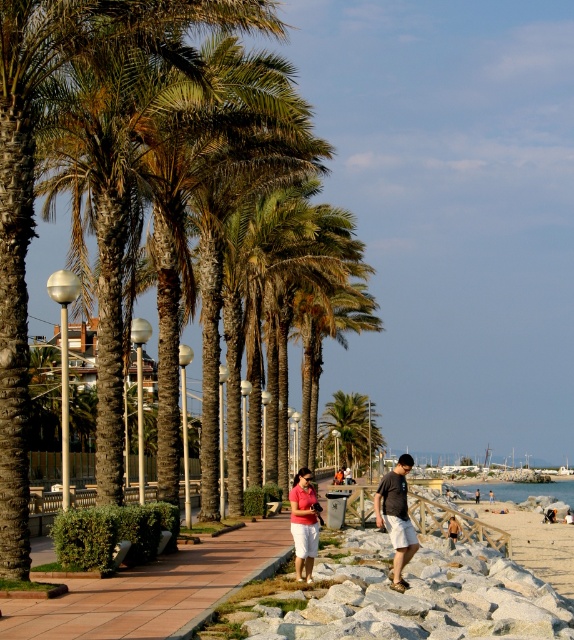
Does dark gray t-shirt at center have a lesser height compared to beige fabric shorts at center?

Incorrect, dark gray t-shirt at center's height does not fall short of beige fabric shorts at center's.

Between dark gray t-shirt at center and beige fabric shorts at center, which one appears on the right side from the viewer's perspective?

Positioned to the right is beige fabric shorts at center.

Which is behind, point (390, 506) or point (449, 529)?

Positioned behind is point (449, 529).

Find the location of a particular element. Image resolution: width=574 pixels, height=640 pixels. dark gray t-shirt at center is located at coordinates (397, 516).

Does green leafy palm tree at center have a greater width compared to matte pink shirt at center?

Indeed, green leafy palm tree at center has a greater width compared to matte pink shirt at center.

The width and height of the screenshot is (574, 640). What do you see at coordinates (350, 426) in the screenshot? I see `green leafy palm tree at center` at bounding box center [350, 426].

Locate an element on the screen. The image size is (574, 640). green leafy palm tree at center is located at coordinates (350, 426).

Is green leafy palm tree at center smaller than beige fabric shorts at center?

No.

Where is `green leafy palm tree at center`? The image size is (574, 640). green leafy palm tree at center is located at coordinates (350, 426).

Does point (351, 422) lie behind point (456, 536)?

Yes.

Find the location of a particular element. The image size is (574, 640). green leafy palm tree at center is located at coordinates (350, 426).